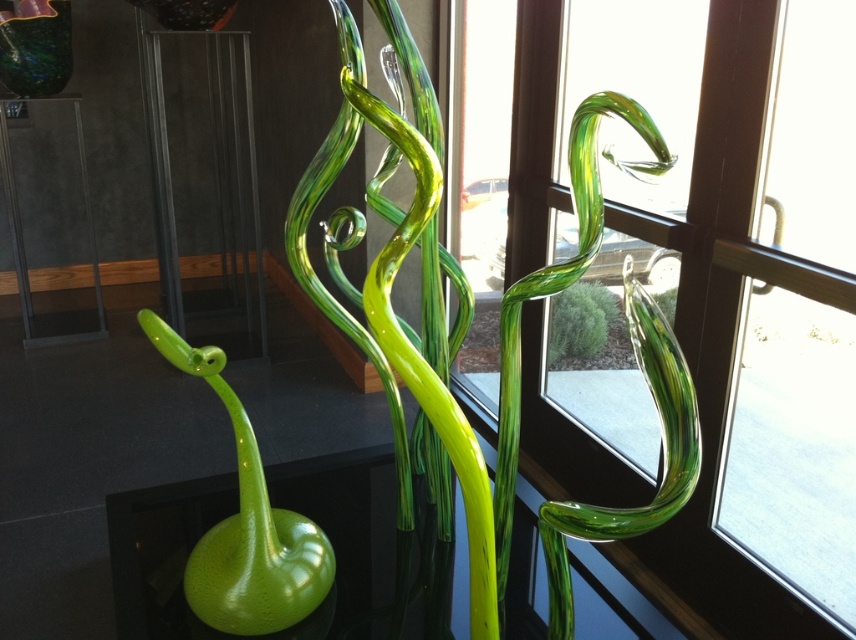
You are an interior designer planning to place a new lamp on the matte black table at left. Considering the height of the table and the green glass plant at center, will the lamp be visible from the front of the room?

The matte black table at left is much taller than the green glass plant at center, so placing a lamp on the table will ensure it is visible from the front of the room.

You are standing in front of the glass sculptures and want to take a photo. You notice two points marked in the scene. The first point is at coordinate point (400, 228) and the second is at point (3, 17). Which point is nearer to you?

Point (400, 228) is closer to the viewer than point (3, 17).

You are an art installer who needs to move the shiny multicolored glass vase at upper left closer to the green glass sculpture at center. Currently, they are 2.60 meters apart. If you want to place them exactly 1.20 meters apart, how much distance do you need to move the vase towards the sculpture?

The current distance between the green glass sculpture at center and the shiny multicolored glass vase at upper left is 2.60 meters. To reduce the distance to 1.20 meters, you need to move the vase 2.60 meters minus 1.20 meters, which equals 1.40 meters closer to the sculpture.